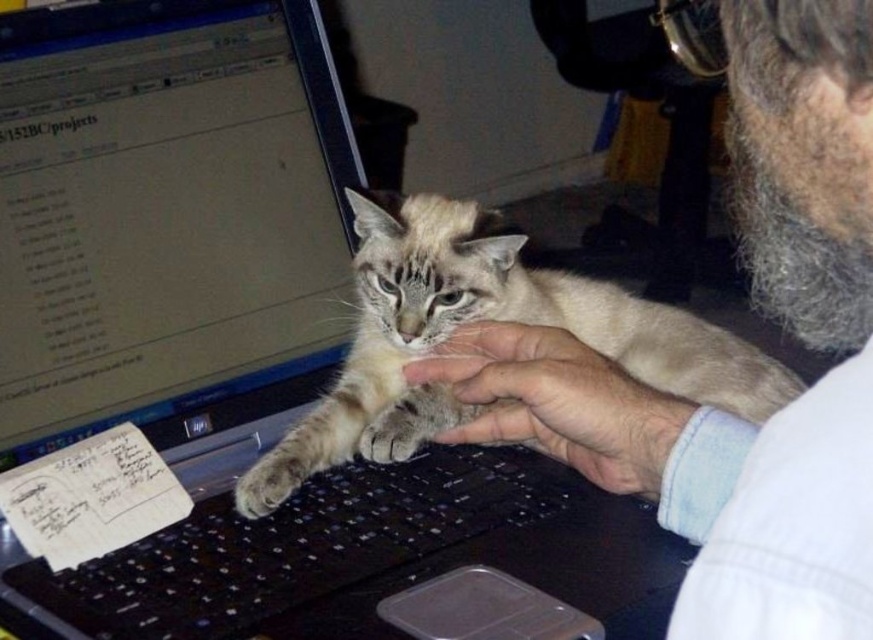
Question: Does fuzzy beige cat at center have a larger size compared to fur at center?

Choices:
 (A) yes
 (B) no

Answer: (A)

Question: Where is fuzzy beige cat at center located in relation to black plastic keyboard at center in the image?

Choices:
 (A) right
 (B) left

Answer: (A)

Question: Estimate the real-world distances between objects in this image. Which object is farther from the fur at center?

Choices:
 (A) black plastic keyboard at center
 (B) fuzzy beige paw at keyboard

Answer: (B)

Question: Can you confirm if fuzzy beige cat at center is positioned to the left of fuzzy beige paw at keyboard?

Choices:
 (A) yes
 (B) no

Answer: (B)

Question: Which is farther from the fur at center?

Choices:
 (A) fuzzy beige cat at center
 (B) fuzzy beige paw at keyboard
 (C) black plastic keyboard at center

Answer: (B)

Question: Which point is farther to the camera?

Choices:
 (A) fur at center
 (B) black plastic keyboard at center

Answer: (A)